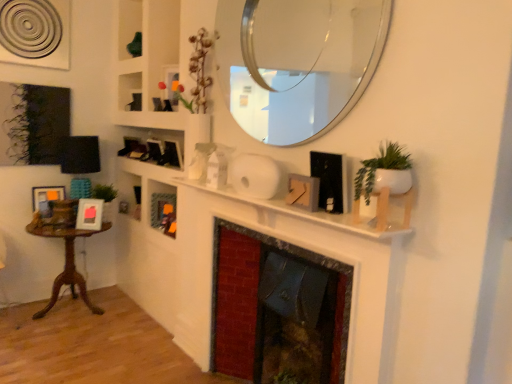
Question: From a real-world perspective, is white matte fireplace at center positioned above or below wooden table at left?

Choices:
 (A) above
 (B) below

Answer: (A)

Question: Considering their positions, is white matte fireplace at center located in front of or behind wooden table at left?

Choices:
 (A) front
 (B) behind

Answer: (A)

Question: Which is nearer to the wooden frame at center?

Choices:
 (A) matte wooden picture frame at left, marked as the 3th picture frame in a right-to-left arrangement
 (B) white matte plant pot at upper right
 (C) marble fireplace at center
 (D) wooden table at left
 (E) white matte fireplace at center

Answer: (D)

Question: Estimate the real-world distances between objects in this image. Which object is farther from the marble fireplace at center?

Choices:
 (A) matte gray picture frame at center, the 1th picture frame viewed from the front
 (B) matte wooden picture frame at left, acting as the 3th picture frame starting from the front
 (C) white matte fireplace at center
 (D) white matte plant pot at upper right
 (E) clear glass mirror at upper center

Answer: (B)